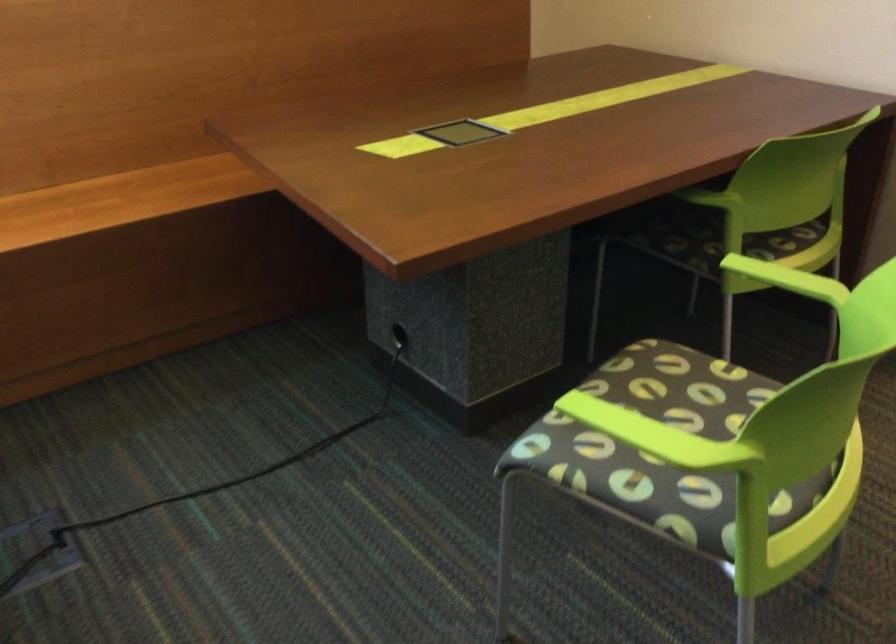
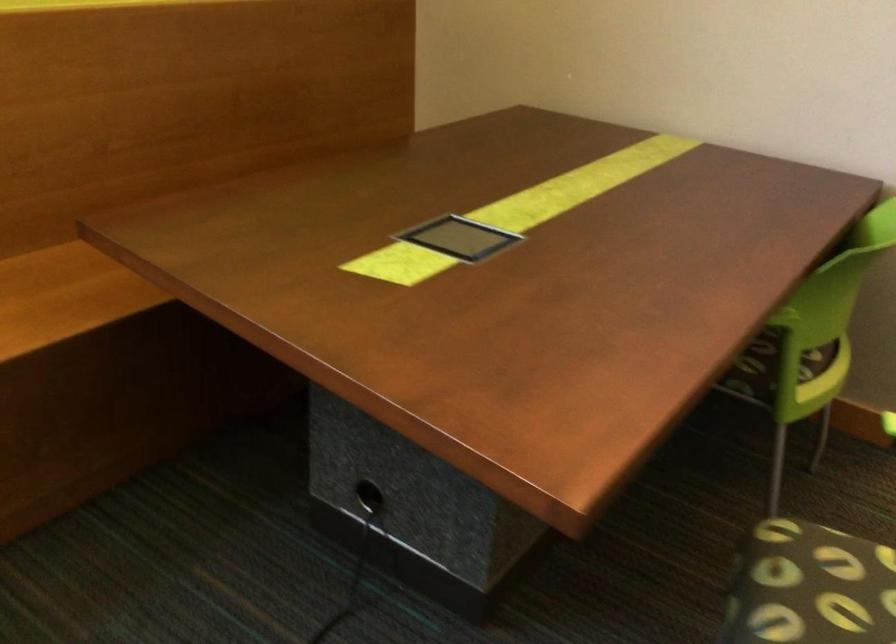
Where in the second image is the point corresponding to the point at 650,380 from the first image?

(815, 587)